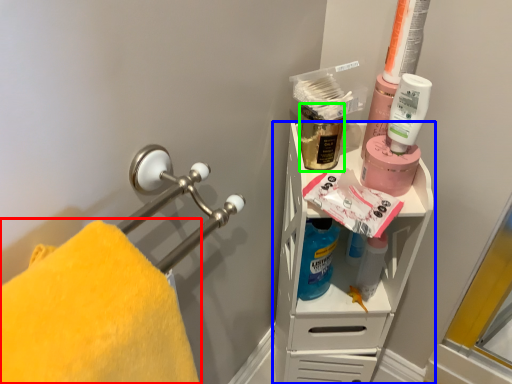
Question: Which object is the farthest from towel (highlighted by a red box)? Choose among these: shelf (highlighted by a blue box) or mouthwash (highlighted by a green box).

Choices:
 (A) shelf
 (B) mouthwash

Answer: (B)